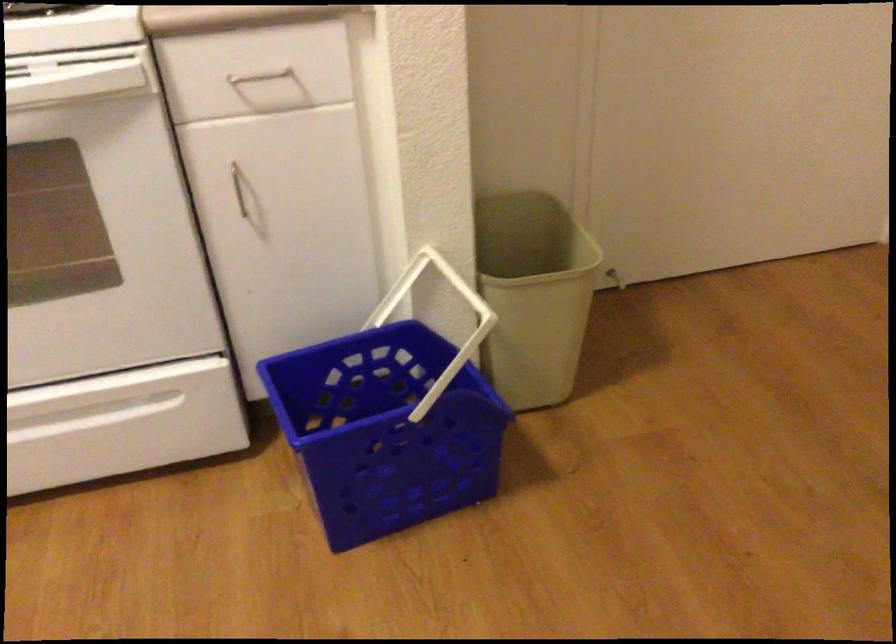
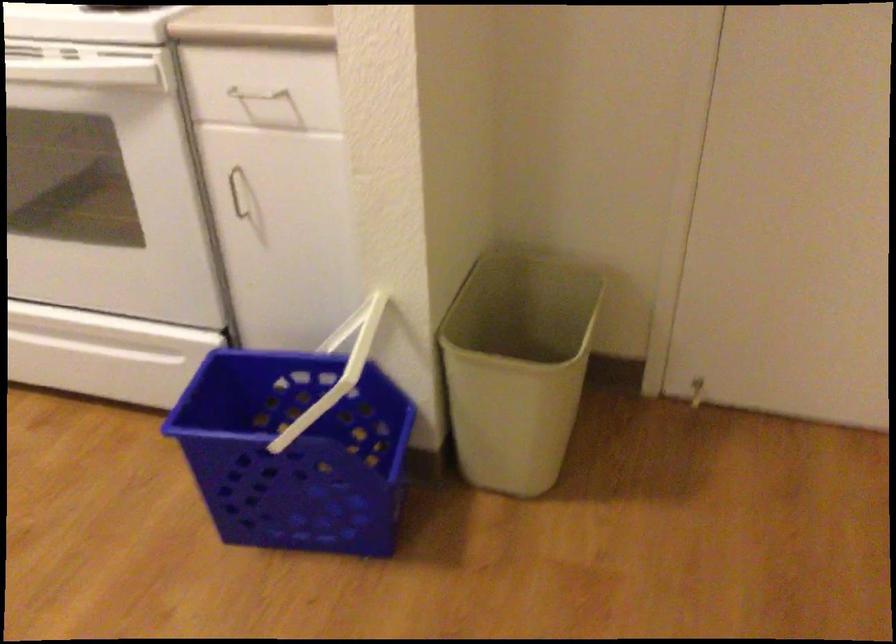
Locate, in the second image, the point that corresponds to (x=236, y=189) in the first image.

(237, 192)